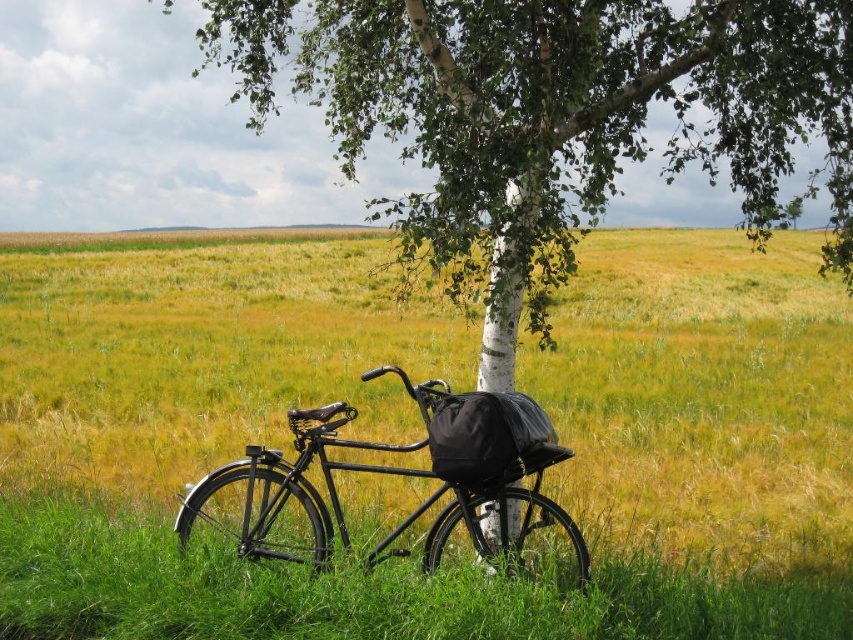
Can you confirm if white bark tree at center is positioned to the left of black matte bicycle at center?

No, white bark tree at center is not to the left of black matte bicycle at center.

Does white bark tree at center have a lesser height compared to black matte bicycle at center?

Incorrect, white bark tree at center's height does not fall short of black matte bicycle at center's.

Who is more forward, (x=329, y=4) or (x=351, y=413)?

Point (x=351, y=413)

This screenshot has width=853, height=640. I want to click on white bark tree at center, so click(549, 120).